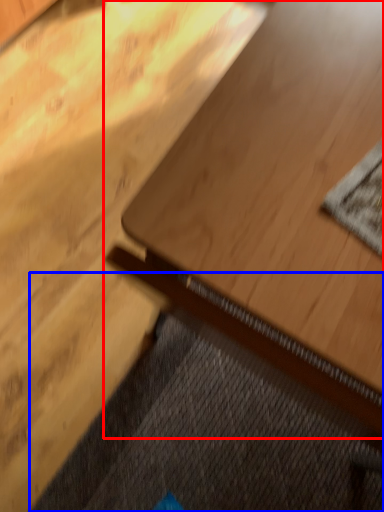
Question: Which object is closer to the camera taking this photo, table (highlighted by a red box) or doormat (highlighted by a blue box)?

Choices:
 (A) table
 (B) doormat

Answer: (A)